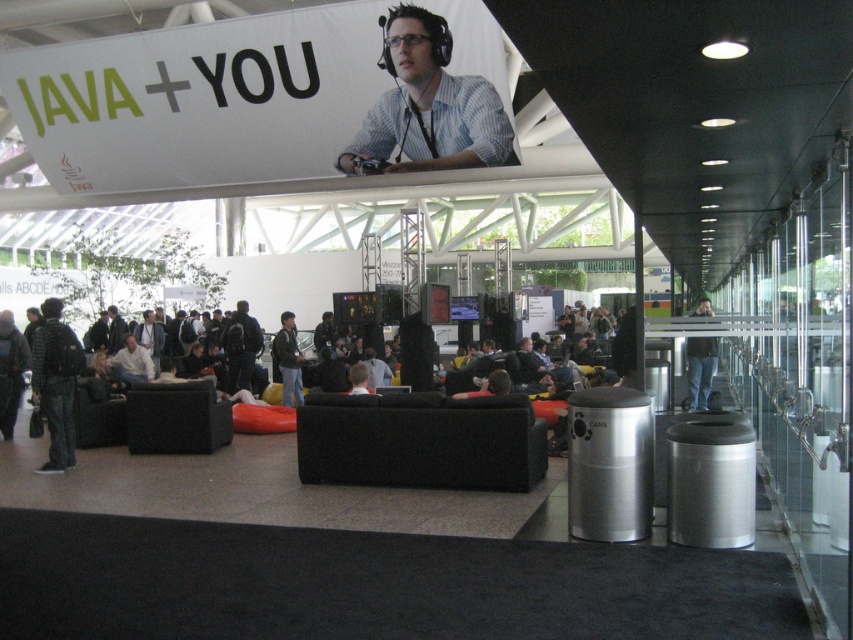
Can you confirm if matte black shirt at center is wider than dark blue jeans at left?

Indeed, matte black shirt at center has a greater width compared to dark blue jeans at left.

Find the location of a particular element. matte black shirt at center is located at coordinates (428, 106).

Where is `matte black shirt at center`? matte black shirt at center is located at coordinates (428, 106).

Consider the image. Can you confirm if jeans at center is wider than dark blue jacket at center?

Yes.

Who is positioned more to the right, jeans at center or dark blue jacket at center?

Positioned to the right is jeans at center.

Who is more forward, (701, 340) or (283, 396)?

Point (283, 396) is more forward.

Locate an element on the screen. Image resolution: width=853 pixels, height=640 pixels. jeans at center is located at coordinates (700, 369).

Can you confirm if dark blue jeans at left is positioned to the right of dark blue jacket at center?

No, dark blue jeans at left is not to the right of dark blue jacket at center.

Which of these two, dark blue jeans at left or dark blue jacket at center, stands shorter?

Standing shorter between the two is dark blue jacket at center.

Between point (53, 376) and point (283, 324), which one is positioned behind?

The point (283, 324) is behind.

The image size is (853, 640). What are the coordinates of `dark blue jeans at left` in the screenshot? It's located at (56, 384).